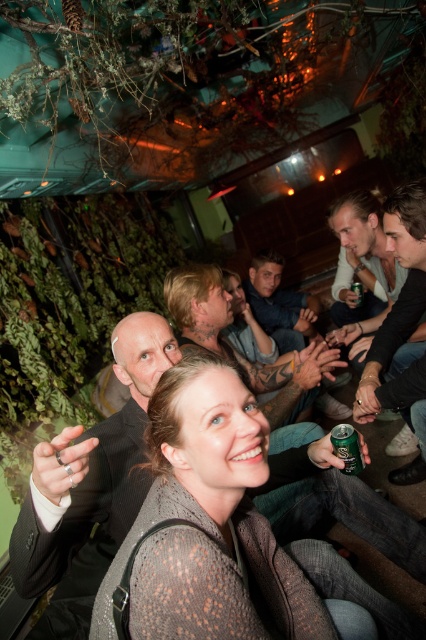
You are a photographer at the event and want to ensure both the knitted sweater at center and the smooth skin face at center are clearly visible in the photo. Given their sizes, which object should you focus on to capture both effectively?

The knitted sweater at center is larger in size than the smooth skin face at center, so focusing on the knitted sweater at center would ensure both are clearly visible as it occupies more space in the frame.

You are a photographer at the event and want to capture a clear photo of the smooth skin face at center without the knitted sweater at center blocking it. Is this possible?

The knitted sweater at center is in front of the smooth skin face at center, so it will block the view. To capture a clear photo of the smooth skin face at center, you need to adjust the angle or position to move the knitted sweater at center out of the frame.

You are at a party and want to take a photo of the knitted sweater at center and the smooth black shirt at right. Which one should you focus on first if you want to capture both clearly in the same frame?

The knitted sweater at center is located below the smooth black shirt at right, so you should focus on the smooth black shirt at right first to ensure both are in focus since it is closer to the camera.